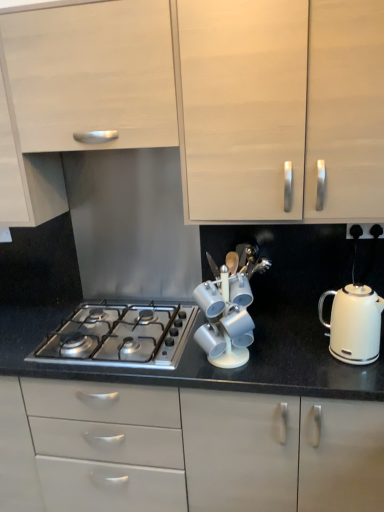
This screenshot has height=512, width=384. What do you see at coordinates (229, 307) in the screenshot?
I see `white glossy cup at center` at bounding box center [229, 307].

At what (x,y) coordinates should I click in order to perform the action: click on matte white cabinet at upper left, arranged as the third cabinetry when ordered from the bottom. Please return your answer as a coordinate pair (x, y). This screenshot has width=384, height=512. Looking at the image, I should click on (26, 174).

Locate an element on the screen. white glossy kettle at right is located at coordinates (354, 324).

This screenshot has height=512, width=384. What do you see at coordinates (354, 324) in the screenshot? I see `white glossy kettle at right` at bounding box center [354, 324].

What is the approximate width of white matte cabinet at upper center, which is counted as the third cabinetry, starting from the top?

white matte cabinet at upper center, which is counted as the third cabinetry, starting from the top, is 14.37 inches in width.

What is the approximate width of white matte cabinet at upper left, arranged as the 4th cabinetry when ordered from the bottom?

white matte cabinet at upper left, arranged as the 4th cabinetry when ordered from the bottom, is 14.37 inches in width.

At what (x,y) coordinates should I click in order to perform the action: click on white glossy cup at center. Please return your answer as a coordinate pair (x, y). Looking at the image, I should click on (229, 307).

From the image's perspective, between white matte cabinet at upper center, the 2th cabinetry when ordered from bottom to top, and white glossy kettle at right, which one is located above?

white matte cabinet at upper center, the 2th cabinetry when ordered from bottom to top, appears higher in the image.

Locate an element on the screen. kitchen appliance that is below the white matte cabinet at upper center, which is counted as the third cabinetry, starting from the top (from the image's perspective) is located at coordinates (354, 324).

Which is in front, white matte cabinet at upper center, the 2th cabinetry when ordered from bottom to top, or white glossy kettle at right?

white matte cabinet at upper center, the 2th cabinetry when ordered from bottom to top, is in front.

From a real-world perspective, who is located lower, white matte cabinet at upper center, the 2th cabinetry when ordered from bottom to top, or white glossy kettle at right?

white glossy kettle at right, from a real-world perspective.

Which object is thinner, matte white cabinet at upper left, arranged as the third cabinetry when ordered from the bottom, or white glossy kettle at right?

white glossy kettle at right.

Which point is more forward, [5,195] or [332,318]?

The point [332,318] is closer to the camera.

Who is bigger, matte white cabinet at upper left, which appears as the 2th cabinetry when viewed from the top, or white glossy kettle at right?

matte white cabinet at upper left, which appears as the 2th cabinetry when viewed from the top.

Is matte white cabinet at upper left, which appears as the 2th cabinetry when viewed from the top, placed right next to white glossy kettle at right?

matte white cabinet at upper left, which appears as the 2th cabinetry when viewed from the top, is not next to white glossy kettle at right, and they're not touching.

From the image's perspective, which one is positioned higher, white glossy cup at center or white matte cabinet at upper left, arranged as the 4th cabinetry when ordered from the bottom?

white matte cabinet at upper left, arranged as the 4th cabinetry when ordered from the bottom, from the image's perspective.

Does white glossy cup at center have a larger size compared to white matte cabinet at upper left, acting as the first cabinetry starting from the top?

No, white glossy cup at center is not bigger than white matte cabinet at upper left, acting as the first cabinetry starting from the top.

Which point is more distant from viewer, (x=233, y=298) or (x=116, y=12)?

Positioned behind is point (x=233, y=298).

Locate an element on the screen. tea set that is above the white matte cabinet at center, which appears as the fourth cabinetry when viewed from the top (from a real-world perspective) is located at coordinates 229,307.

Which of these two, white matte cabinet at center, which appears as the fourth cabinetry when viewed from the top, or white glossy cup at center, is bigger?

white matte cabinet at center, which appears as the fourth cabinetry when viewed from the top, is bigger.

Is white matte cabinet at center, which appears as the fourth cabinetry when viewed from the top, touching white glossy cup at center?

No, white matte cabinet at center, which appears as the fourth cabinetry when viewed from the top, is not touching white glossy cup at center.

Considering the relative sizes of white matte cabinet at upper left, acting as the first cabinetry starting from the top, and white glossy kettle at right in the image provided, is white matte cabinet at upper left, acting as the first cabinetry starting from the top, taller than white glossy kettle at right?

Indeed, white matte cabinet at upper left, acting as the first cabinetry starting from the top, has a greater height compared to white glossy kettle at right.

What's the angular difference between white matte cabinet at upper left, acting as the first cabinetry starting from the top, and white glossy kettle at right's facing directions?

The angular difference between white matte cabinet at upper left, acting as the first cabinetry starting from the top, and white glossy kettle at right is 0.0686 degrees.

Which object is wider, white matte cabinet at upper left, acting as the first cabinetry starting from the top, or white glossy kettle at right?

white matte cabinet at upper left, acting as the first cabinetry starting from the top, is wider.

Can you tell me how much white matte cabinet at upper center, the 2th cabinetry when ordered from bottom to top, and white glossy cup at center differ in facing direction?

white matte cabinet at upper center, the 2th cabinetry when ordered from bottom to top, and white glossy cup at center are facing 0.0682 degrees away from each other.

How distant is white matte cabinet at upper center, which is counted as the third cabinetry, starting from the top, from white glossy cup at center?

A distance of 19.09 inches exists between white matte cabinet at upper center, which is counted as the third cabinetry, starting from the top, and white glossy cup at center.

Which object is thinner, white matte cabinet at upper center, the 2th cabinetry when ordered from bottom to top, or white glossy cup at center?

white glossy cup at center is thinner.

Considering the relative positions of white matte cabinet at upper center, the 2th cabinetry when ordered from bottom to top, and white glossy cup at center in the image provided, is white matte cabinet at upper center, the 2th cabinetry when ordered from bottom to top, to the right of white glossy cup at center from the viewer's perspective?

Correct, you'll find white matte cabinet at upper center, the 2th cabinetry when ordered from bottom to top, to the right of white glossy cup at center.

Consider the image. Can you confirm if white glossy kettle at right is bigger than matte white cabinet at upper left, arranged as the third cabinetry when ordered from the bottom?

Incorrect, white glossy kettle at right is not larger than matte white cabinet at upper left, arranged as the third cabinetry when ordered from the bottom.

Is point (348, 312) in front of point (45, 213)?

Yes.

From the image's perspective, relative to matte white cabinet at upper left, arranged as the third cabinetry when ordered from the bottom, is white glossy kettle at right above or below?

white glossy kettle at right is situated lower than matte white cabinet at upper left, arranged as the third cabinetry when ordered from the bottom, in the image.

Does white glossy kettle at right turn towards matte white cabinet at upper left, which appears as the 2th cabinetry when viewed from the top?

No, white glossy kettle at right does not turn towards matte white cabinet at upper left, which appears as the 2th cabinetry when viewed from the top.

This screenshot has height=512, width=384. I want to click on kitchen appliance located below the white matte cabinet at upper center, which is counted as the third cabinetry, starting from the top (from the image's perspective), so click(354, 324).

Where is `kitchen appliance in front of the matte white cabinet at upper left, arranged as the third cabinetry when ordered from the bottom`? This screenshot has width=384, height=512. kitchen appliance in front of the matte white cabinet at upper left, arranged as the third cabinetry when ordered from the bottom is located at coordinates (354, 324).

Looking at the image, which one is located further to white glossy cup at center, white matte cabinet at upper left, acting as the first cabinetry starting from the top, or white matte cabinet at center, the 1th cabinetry in the bottom-to-top sequence?

The object further to white glossy cup at center is white matte cabinet at upper left, acting as the first cabinetry starting from the top.

From the image, which object appears to be farther from stainless steel gas stove at center, white matte cabinet at center, which appears as the fourth cabinetry when viewed from the top, or matte white cabinet at upper left, which appears as the 2th cabinetry when viewed from the top?

matte white cabinet at upper left, which appears as the 2th cabinetry when viewed from the top.

Based on their spatial positions, is white matte cabinet at upper center, the 2th cabinetry when ordered from bottom to top, or matte white cabinet at upper left, arranged as the third cabinetry when ordered from the bottom, further from stainless steel gas stove at center?

white matte cabinet at upper center, the 2th cabinetry when ordered from bottom to top, is further to stainless steel gas stove at center.

When comparing their distances from white glossy kettle at right, does white matte cabinet at upper center, the 2th cabinetry when ordered from bottom to top, or white glossy cup at center seem further?

white matte cabinet at upper center, the 2th cabinetry when ordered from bottom to top, is further to white glossy kettle at right.

Considering their positions, is white matte cabinet at center, the 1th cabinetry in the bottom-to-top sequence, positioned closer to white glossy cup at center than white glossy kettle at right?

Based on the image, white glossy kettle at right appears to be nearer to white glossy cup at center.

Estimate the real-world distances between objects in this image. Which object is further from white glossy kettle at right, white glossy cup at center or white matte cabinet at upper center, the 2th cabinetry when ordered from bottom to top?

Among the two, white matte cabinet at upper center, the 2th cabinetry when ordered from bottom to top, is located further to white glossy kettle at right.

From the picture: Estimate the real-world distances between objects in this image. Which object is closer to matte white cabinet at upper left, arranged as the third cabinetry when ordered from the bottom, white matte cabinet at center, the 1th cabinetry in the bottom-to-top sequence, or white matte cabinet at upper left, arranged as the 4th cabinetry when ordered from the bottom?

Among the two, white matte cabinet at upper left, arranged as the 4th cabinetry when ordered from the bottom, is located nearer to matte white cabinet at upper left, arranged as the third cabinetry when ordered from the bottom.

From the picture: Based on their spatial positions, is stainless steel gas stove at center or white matte cabinet at upper left, acting as the first cabinetry starting from the top, closer to matte white cabinet at upper left, which appears as the 2th cabinetry when viewed from the top?

white matte cabinet at upper left, acting as the first cabinetry starting from the top, is positioned closer to the anchor matte white cabinet at upper left, which appears as the 2th cabinetry when viewed from the top.

Identify the location of tea set between white matte cabinet at center, which appears as the fourth cabinetry when viewed from the top, and white glossy kettle at right, in the horizontal direction. This screenshot has height=512, width=384. (229, 307).

Identify the location of tea set between white matte cabinet at upper center, which is counted as the third cabinetry, starting from the top, and white matte cabinet at center, the 1th cabinetry in the bottom-to-top sequence, in the vertical direction. (229, 307).

Where is `tea set between matte white cabinet at upper left, which appears as the 2th cabinetry when viewed from the top, and white matte cabinet at center, which appears as the fourth cabinetry when viewed from the top, in the up-down direction`? The width and height of the screenshot is (384, 512). tea set between matte white cabinet at upper left, which appears as the 2th cabinetry when viewed from the top, and white matte cabinet at center, which appears as the fourth cabinetry when viewed from the top, in the up-down direction is located at coordinates (229, 307).

This screenshot has width=384, height=512. Find the location of `tea set between white matte cabinet at upper center, the 2th cabinetry when ordered from bottom to top, and white glossy kettle at right in the up-down direction`. tea set between white matte cabinet at upper center, the 2th cabinetry when ordered from bottom to top, and white glossy kettle at right in the up-down direction is located at coordinates (229, 307).